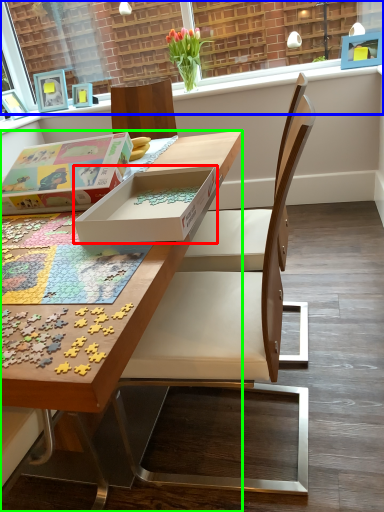
Question: Which object is the closest to the box (highlighted by a red box)? Choose among these: window frame (highlighted by a blue box) or desk (highlighted by a green box).

Choices:
 (A) window frame
 (B) desk

Answer: (B)